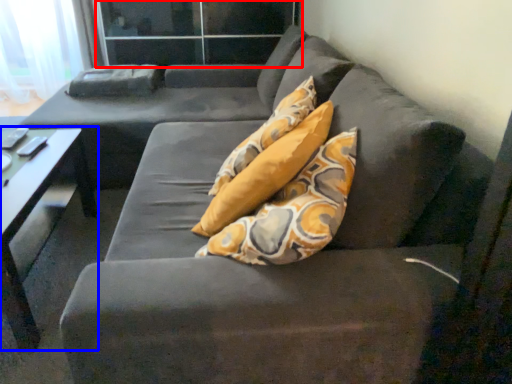
Question: Which of the following is the closest to the observer, glass door (highlighted by a red box) or table (highlighted by a blue box)?

Choices:
 (A) glass door
 (B) table

Answer: (B)